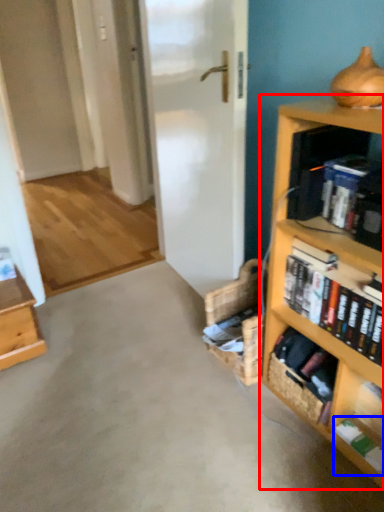
Question: Which point is closer to the camera, bookcase (highlighted by a red box) or book (highlighted by a blue box)?

Choices:
 (A) bookcase
 (B) book

Answer: (A)